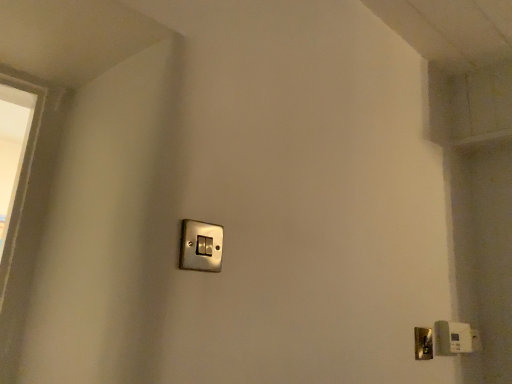
Question: Is satin silver light switch at lower right, which is the first light switch from right to left, inside or outside of metallic silver light switch at center, the first light switch viewed from the left?

Choices:
 (A) inside
 (B) outside

Answer: (B)

Question: Would you say satin silver light switch at lower right, the first light switch when ordered from bottom to top, is to the left or to the right of metallic silver light switch at center, the first light switch viewed from the left, in the picture?

Choices:
 (A) right
 (B) left

Answer: (A)

Question: Estimate the real-world distances between objects in this image. Which object is closer to the metallic silver light switch at center, which appears as the second light switch when viewed from the right?

Choices:
 (A) satin silver light switch at lower right, arranged as the second light switch when viewed from the top
 (B) polished brass door handle at lower right

Answer: (B)

Question: Estimate the real-world distances between objects in this image. Which object is closer to the satin silver light switch at lower right, arranged as the second light switch when viewed from the top?

Choices:
 (A) metallic silver light switch at center, acting as the 1th light switch starting from the top
 (B) polished brass door handle at lower right

Answer: (B)